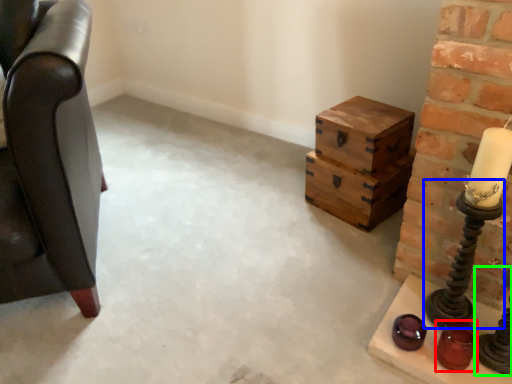
Question: Which object is the farthest from candle holder (highlighted by a red box)? Choose among these: candle holder (highlighted by a blue box) or candle holder (highlighted by a green box).

Choices:
 (A) candle holder
 (B) candle holder

Answer: (A)